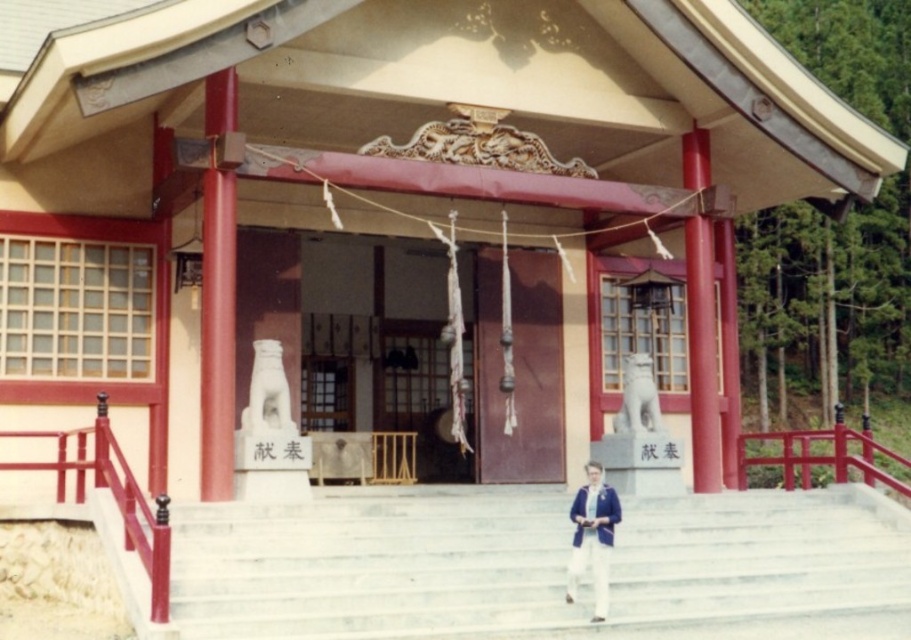
You are standing at the entrance of the shrine and want to place two offerings. The first offering should be placed at point (x=867, y=589) and the second at point (x=613, y=512). Which offering location is closer to the shrine entrance?

Point (x=613, y=512) is closer to the shrine entrance because it is in front of point (x=867, y=589), which is behind it.

You are a visitor at the shrine and want to place your blue fabric jacket at center on the white marble stairs at center. Can you do this without moving more than 4 meters?

The white marble stairs at center and blue fabric jacket at center are 4.14 meters apart from each other. Since the distance is more than 4 meters, you cannot place the blue fabric jacket at center on the white marble stairs at center without moving more than 4 meters.